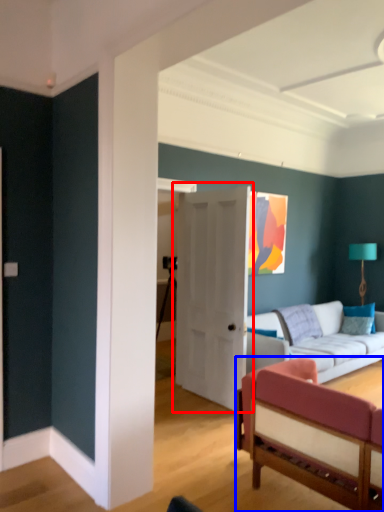
Question: Which of the following is the closest to the observer, door (highlighted by a red box) or studio couch (highlighted by a blue box)?

Choices:
 (A) door
 (B) studio couch

Answer: (B)